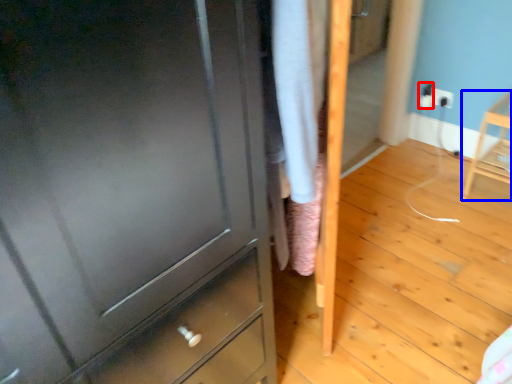
Question: Which point is closer to the camera, electric outlet (highlighted by a red box) or furniture (highlighted by a blue box)?

Choices:
 (A) electric outlet
 (B) furniture

Answer: (B)